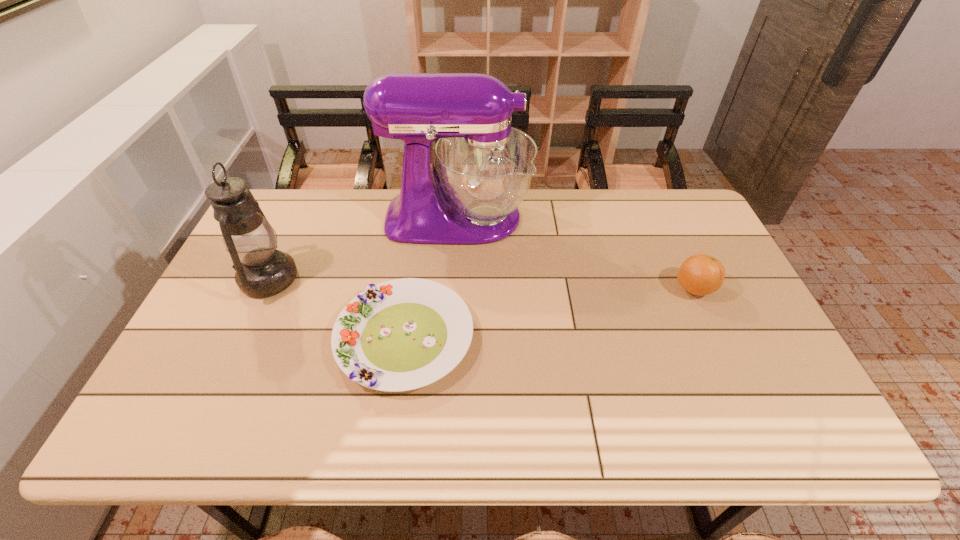
Locate an element on the screen. This screenshot has height=540, width=960. empty location between the rightmost object and the tallest object is located at coordinates (576, 253).

Identify the location of free space between the leftmost object and the farthest object. (363, 248).

You are a GUI agent. You are given a task and a screenshot of the screen. Output one action in this format:
    pyautogui.click(x=<x>, y=<y>)
    Task: Click on the free spot between the rightmost object and the oil lamp
    The height and width of the screenshot is (540, 960).
    Given the screenshot: What is the action you would take?
    pyautogui.click(x=481, y=284)

Identify the location of vacant area that lies between the second shortest object and the salad plate. (549, 313).

Where is `empty location between the shortest object and the orange`? empty location between the shortest object and the orange is located at coordinates (549, 313).

I want to click on vacant point located between the second shortest object and the shortest object, so click(549, 313).

The height and width of the screenshot is (540, 960). Find the location of `vacant area between the rightmost object and the shortest object`. vacant area between the rightmost object and the shortest object is located at coordinates (549, 313).

Identify the location of free space that is in between the salad plate and the tallest object. click(431, 278).

Where is `vacant point located between the rightmost object and the salad plate`? vacant point located between the rightmost object and the salad plate is located at coordinates (549, 313).

Locate which object ranks in proximity to the mixer. Please provide its 2D coordinates. Your answer should be formatted as a tuple, i.e. [(x, y)], where the tuple contains the x and y coordinates of a point satisfying the conditions above.

[(403, 334)]